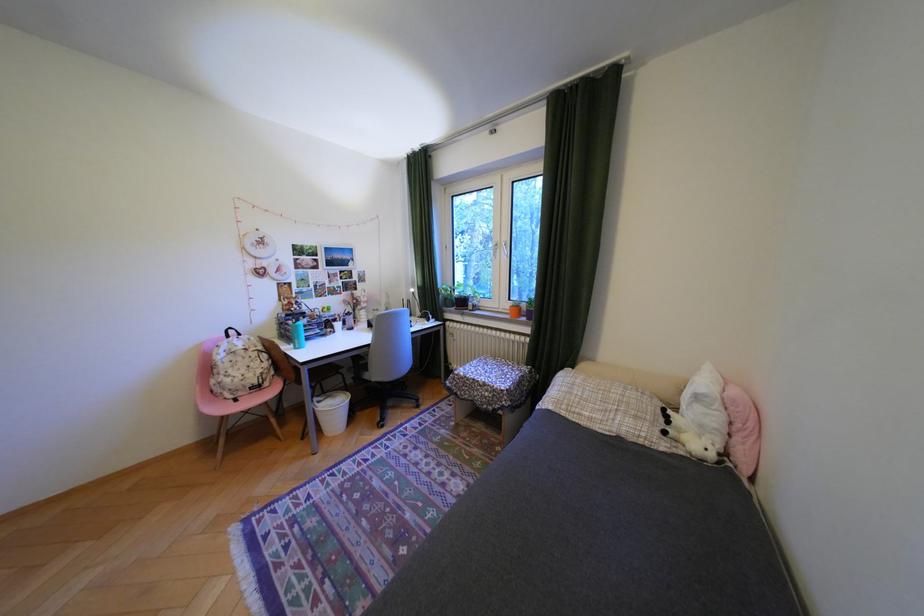
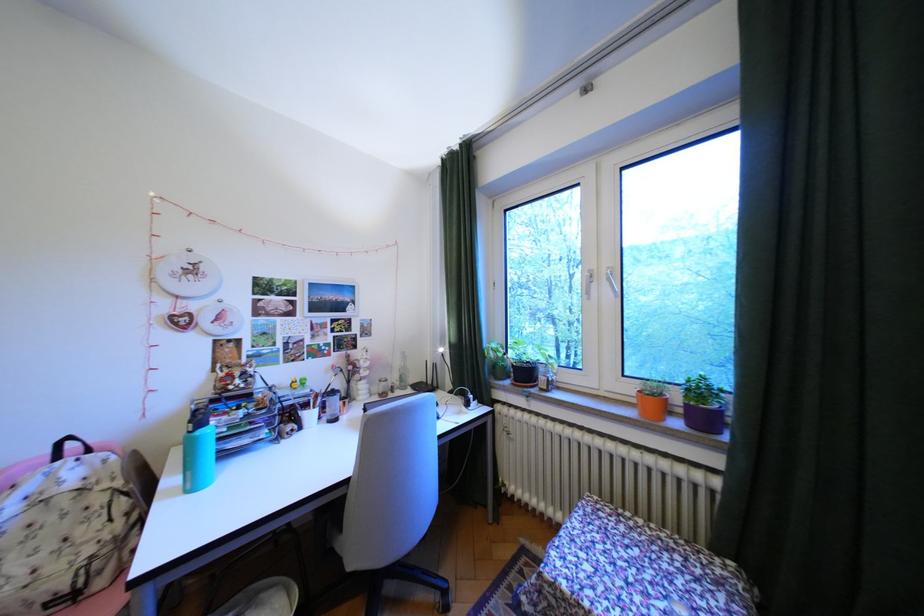
Find the pixel in the second image that matches [542,302] in the first image.

(710, 391)